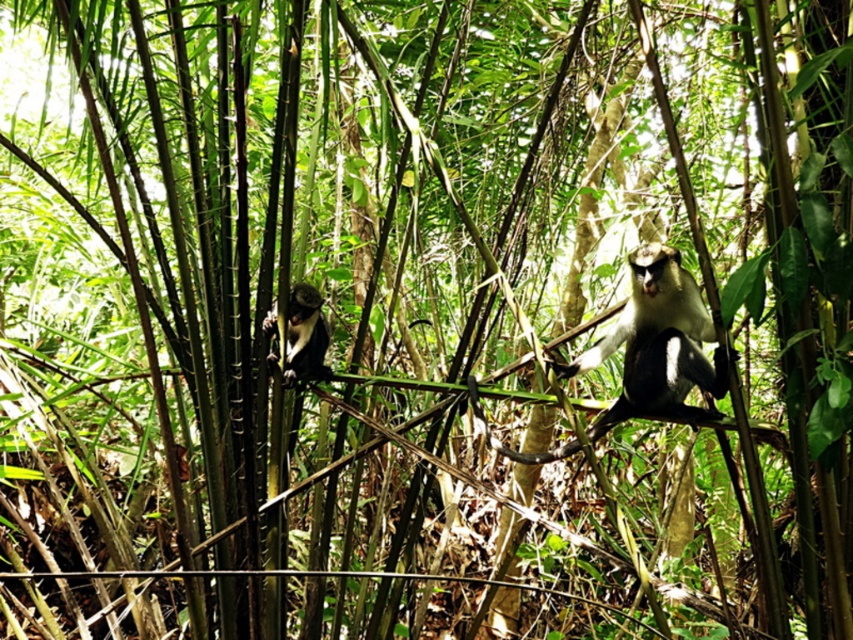
Who is positioned more to the right, white fur monkey at center or black fur monkey at left?

white fur monkey at center

Who is positioned more to the left, white fur monkey at center or black fur monkey at left?

Positioned to the left is black fur monkey at left.

Is point (677, 284) positioned behind point (300, 282)?

No, it is not.

The height and width of the screenshot is (640, 853). I want to click on white fur monkey at center, so click(659, 344).